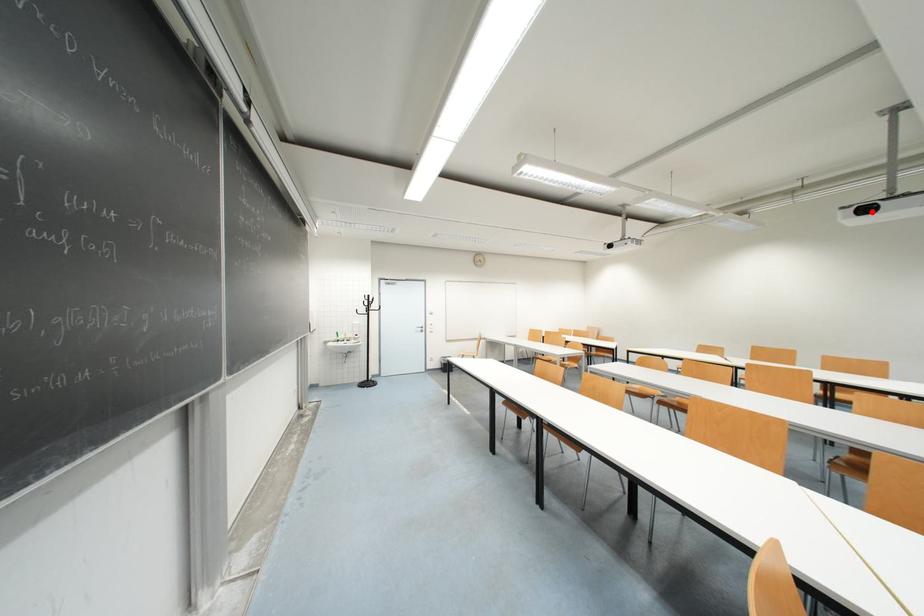
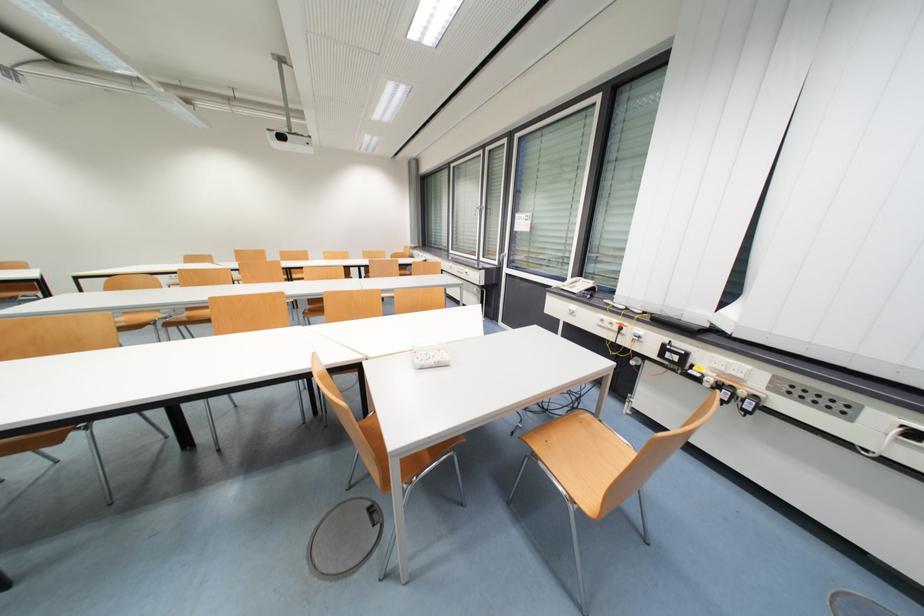
The point at the highlighted location is marked in the first image. Where is the corresponding point in the second image?

(286, 139)